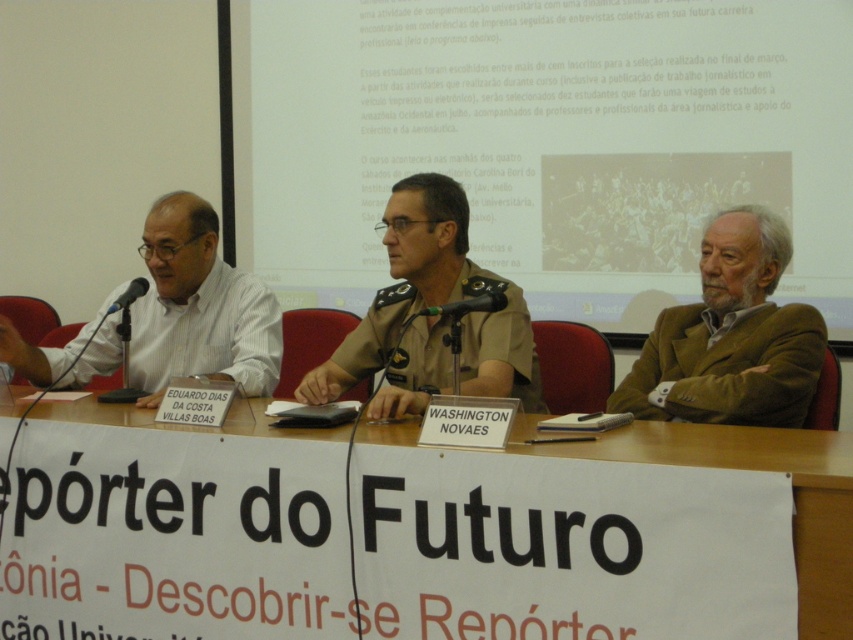
You are a guest speaker at the event and need to place a name tag on the table. The name tag must be placed above the brown woolen jacket at right. Is there enough space between the white paperboard at center and the edge of the table to do this?

The white paperboard at center is located below the brown woolen jacket at right, meaning there is space above the jacket to place the name tag without overlapping the paperboard. Yes, there is enough space.

Consider the image. You are organizing a presentation and need to place a name tag on the table. The name tag is the same size as the brown woolen jacket at right. Will it fit on the white paperboard at center without overlapping the edges?

The white paperboard at center is larger in size than the brown woolen jacket at right, so the name tag will fit on the white paperboard at center without overlapping the edges.

You are a sound technician setting up for the panel discussion. You need to place a new microphone that requires 1.2 meters of space between it and the existing microphones. Given the current setup with the green matte microphone at center and the matte black microphone at left, is there enough space between them to accommodate the new microphone?

The distance between the green matte microphone at center and the matte black microphone at left is 1.02 meters, which is less than the required 1.2 meters. Therefore, there is not enough space to place the new microphone between them.